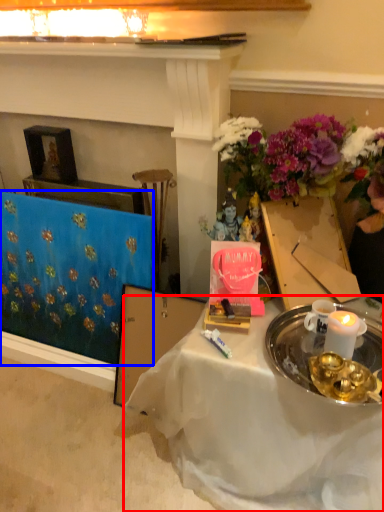
Question: Among these objects, which one is farthest to the camera, desk (highlighted by a red box) or tablecloth (highlighted by a blue box)?

Choices:
 (A) desk
 (B) tablecloth

Answer: (B)